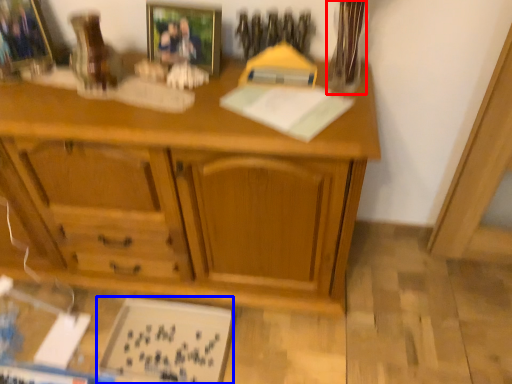
Question: Which point is further to the camera, glass vase (highlighted by a red box) or book (highlighted by a blue box)?

Choices:
 (A) glass vase
 (B) book

Answer: (B)